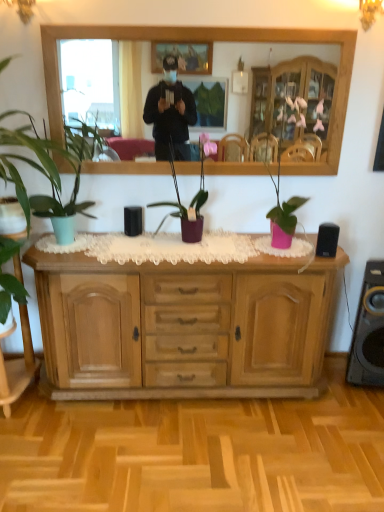
Question: Does green matte plant at left, acting as the third houseplant starting from the right, have a greater width compared to matte purple pot at center, which is the third houseplant in left-to-right order?

Choices:
 (A) no
 (B) yes

Answer: (B)

Question: Does green matte plant at left, acting as the third houseplant starting from the right, have a lesser height compared to matte purple pot at center, which is the third houseplant in left-to-right order?

Choices:
 (A) no
 (B) yes

Answer: (A)

Question: From the image's perspective, is green matte plant at left, acting as the third houseplant starting from the right, over matte purple pot at center, which is the 1th houseplant from right to left?

Choices:
 (A) no
 (B) yes

Answer: (B)

Question: Is green matte plant at left, positioned as the first houseplant in left-to-right order, facing towards matte purple pot at center, which is the third houseplant in left-to-right order?

Choices:
 (A) yes
 (B) no

Answer: (B)

Question: Is green matte plant at left, positioned as the first houseplant in left-to-right order, to the right of matte purple pot at center, which is the third houseplant in left-to-right order, from the viewer's perspective?

Choices:
 (A) yes
 (B) no

Answer: (B)

Question: Is matte green plant at left, the 2th houseplant in the left-to-right sequence, in front of or behind wooden mirror at upper center in the image?

Choices:
 (A) front
 (B) behind

Answer: (A)

Question: From the image's perspective, is matte green plant at left, the 2th houseplant in the left-to-right sequence, located above or below wooden mirror at upper center?

Choices:
 (A) below
 (B) above

Answer: (A)

Question: From a real-world perspective, relative to wooden mirror at upper center, is matte green plant at left, the 2th houseplant in the left-to-right sequence, vertically above or below?

Choices:
 (A) below
 (B) above

Answer: (A)

Question: Would you say matte green plant at left, the 2th houseplant in the left-to-right sequence, is inside or outside wooden mirror at upper center?

Choices:
 (A) outside
 (B) inside

Answer: (A)

Question: Considering the relative positions of matte purple pot at center, which is the 1th houseplant from right to left, and light brown wood cabinet at center in the image provided, is matte purple pot at center, which is the 1th houseplant from right to left, to the left or to the right of light brown wood cabinet at center?

Choices:
 (A) left
 (B) right

Answer: (A)

Question: Is matte purple pot at center, which is the third houseplant in left-to-right order, spatially inside light brown wood cabinet at center, or outside of it?

Choices:
 (A) outside
 (B) inside

Answer: (A)

Question: From a real-world perspective, is matte purple pot at center, which is the third houseplant in left-to-right order, above or below light brown wood cabinet at center?

Choices:
 (A) above
 (B) below

Answer: (A)

Question: From the image's perspective, relative to light brown wood cabinet at center, is matte purple pot at center, which is the 1th houseplant from right to left, above or below?

Choices:
 (A) above
 (B) below

Answer: (A)

Question: Would you say wooden mirror at upper center is to the left or to the right of matte purple pot at center, which is the 1th houseplant from right to left, in the picture?

Choices:
 (A) left
 (B) right

Answer: (B)

Question: From a real-world perspective, relative to matte purple pot at center, which is the 1th houseplant from right to left, is wooden mirror at upper center vertically above or below?

Choices:
 (A) above
 (B) below

Answer: (A)